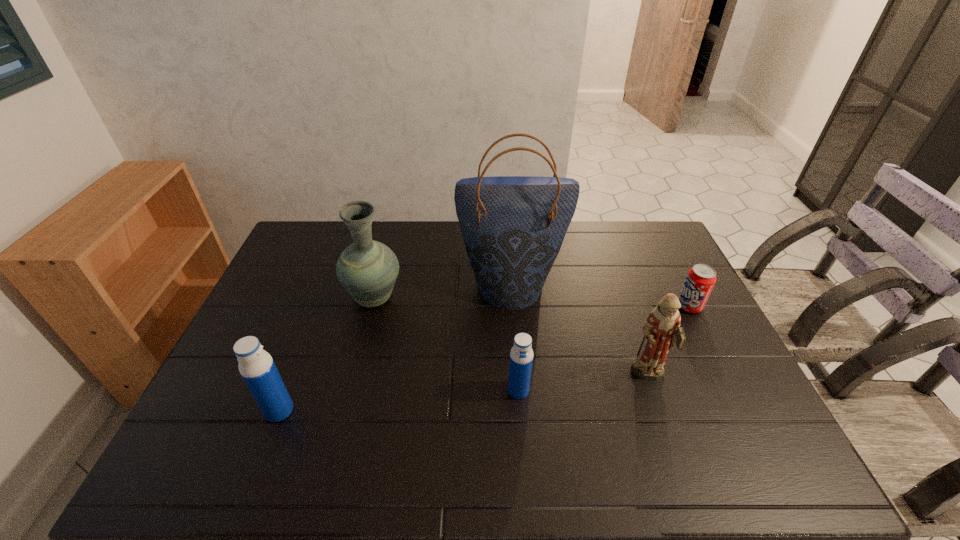
Identify the location of vacant space located 0.230m on the right of the leftmost object. (385, 410).

You are a GUI agent. You are given a task and a screenshot of the screen. Output one action in this format:
    pyautogui.click(x=<x>, y=<y>)
    Task: Click on the free region located 0.140m on the back of the right water bottle
    
    Given the screenshot: What is the action you would take?
    pyautogui.click(x=515, y=341)

Locate an element on the screen. The image size is (960, 540). vacant space located 0.150m on the handle side of the pitcher is located at coordinates (387, 252).

Find the location of a particular element. This screenshot has height=540, width=960. vacant space located on the handle side of the pitcher is located at coordinates (382, 269).

Locate an element on the screen. The width and height of the screenshot is (960, 540). free space located 0.210m on the handle side of the pitcher is located at coordinates (389, 242).

Find the location of a particular element. The width and height of the screenshot is (960, 540). vacant space located 0.140m on the left of the shopping bag is located at coordinates (416, 286).

Identify the location of vacant space positioned 0.060m on the front-facing side of the fifth object from left to right. Image resolution: width=960 pixels, height=540 pixels. (660, 410).

The height and width of the screenshot is (540, 960). Identify the location of vacant space located 0.140m on the surface of the shortest object. (633, 306).

Image resolution: width=960 pixels, height=540 pixels. I want to click on blank space located on the surface of the shortest object, so click(x=591, y=306).

This screenshot has height=540, width=960. I want to click on vacant space situated 0.270m on the surface of the shortest object, so click(x=591, y=306).